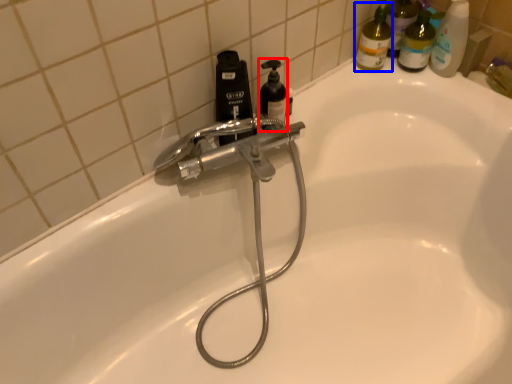
Question: Which object appears closest to the camera in this image, soap dispenser (highlighted by a red box) or cleaning product (highlighted by a blue box)?

Choices:
 (A) soap dispenser
 (B) cleaning product

Answer: (A)